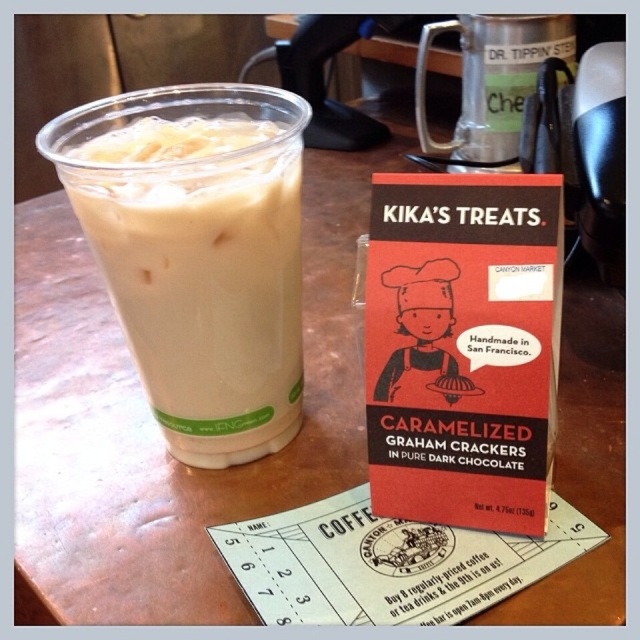
Which is behind, point (288, 209) or point (484, 60)?

Positioned behind is point (484, 60).

Does white frothy milk at left have a smaller size compared to metallic silver cup at upper center?

Yes.

Image resolution: width=640 pixels, height=640 pixels. Identify the location of white frothy milk at left. (204, 276).